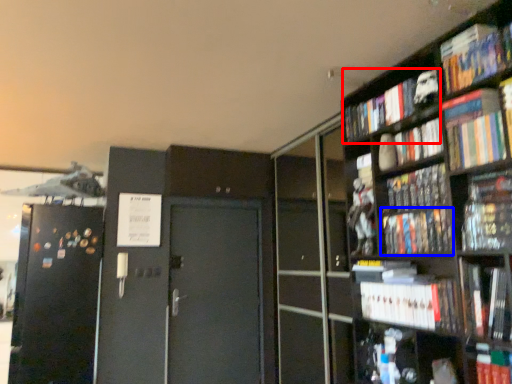
Question: Which of the following is the farthest to the observer, book (highlighted by a red box) or book (highlighted by a blue box)?

Choices:
 (A) book
 (B) book

Answer: (A)